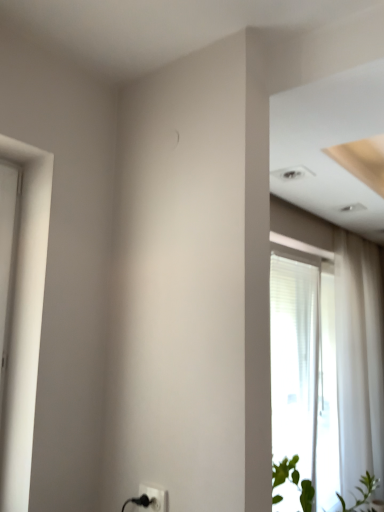
Question: Is transparent glass window at right positioned behind black plastic electric outlet at lower center?

Choices:
 (A) yes
 (B) no

Answer: (A)

Question: Can black plastic electric outlet at lower center be found inside transparent glass window at right?

Choices:
 (A) yes
 (B) no

Answer: (B)

Question: Is transparent glass window at right aimed at black plastic electric outlet at lower center?

Choices:
 (A) no
 (B) yes

Answer: (A)

Question: From a real-world perspective, is transparent glass window at right below black plastic electric outlet at lower center?

Choices:
 (A) no
 (B) yes

Answer: (A)

Question: Does transparent glass window at right have a greater height compared to black plastic electric outlet at lower center?

Choices:
 (A) yes
 (B) no

Answer: (A)

Question: From a real-world perspective, relative to black plastic electric outlet at lower center, is transparent glass window at right vertically above or below?

Choices:
 (A) below
 (B) above

Answer: (B)

Question: Is transparent glass window at right to the left or to the right of black plastic electric outlet at lower center in the image?

Choices:
 (A) right
 (B) left

Answer: (A)

Question: From their relative heights in the image, would you say transparent glass window at right is taller or shorter than black plastic electric outlet at lower center?

Choices:
 (A) short
 (B) tall

Answer: (B)

Question: In the image, is transparent glass window at right positioned in front of or behind black plastic electric outlet at lower center?

Choices:
 (A) behind
 (B) front

Answer: (A)

Question: Considering the relative positions of transparent glass window at right and green leafy plant at lower right in the image provided, is transparent glass window at right to the left or to the right of green leafy plant at lower right?

Choices:
 (A) right
 (B) left

Answer: (A)

Question: In the image, is transparent glass window at right positioned in front of or behind green leafy plant at lower right?

Choices:
 (A) front
 (B) behind

Answer: (B)

Question: From a real-world perspective, is transparent glass window at right physically located above or below green leafy plant at lower right?

Choices:
 (A) above
 (B) below

Answer: (A)

Question: Looking at their shapes, would you say transparent glass window at right is wider or thinner than green leafy plant at lower right?

Choices:
 (A) thin
 (B) wide

Answer: (A)

Question: Is black plastic electric outlet at lower center taller or shorter than green leafy plant at lower right?

Choices:
 (A) short
 (B) tall

Answer: (A)

Question: Is black plastic electric outlet at lower center to the left or to the right of green leafy plant at lower right in the image?

Choices:
 (A) left
 (B) right

Answer: (A)